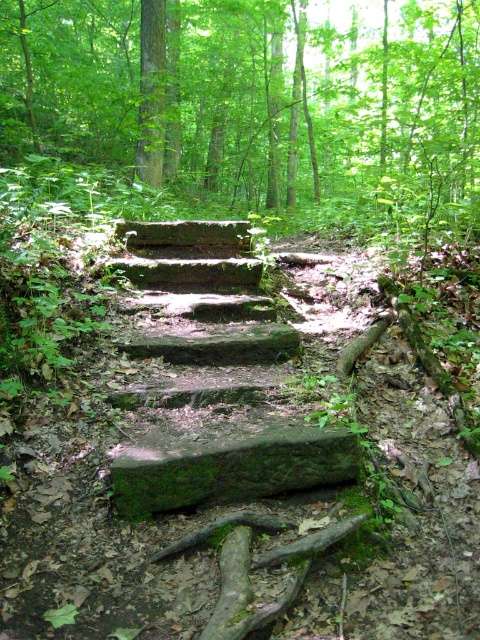
You are standing at the base of the rustic stone staircase in the forest. You see two points marked in the scene. Which point, point (192, 492) or point (302, 472), is closer to you?

Point (192, 492) is closer to you than point (302, 472).

You are a hiker carrying a heavy backpack and want to take a break. You see the green mossy stone steps at center. Can you sit on them?

The green mossy stone steps at center are 18.79 feet away from you, so you can walk to them and sit down.